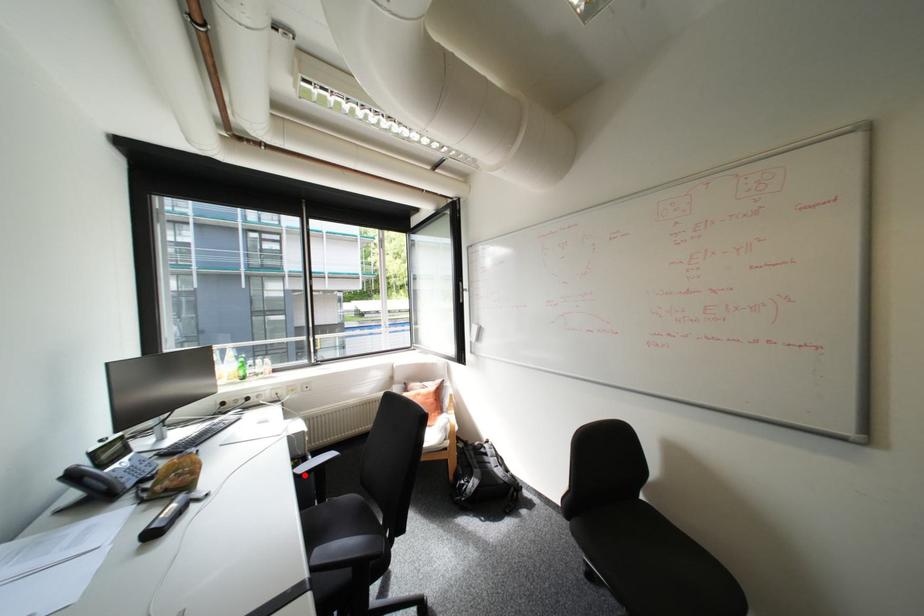
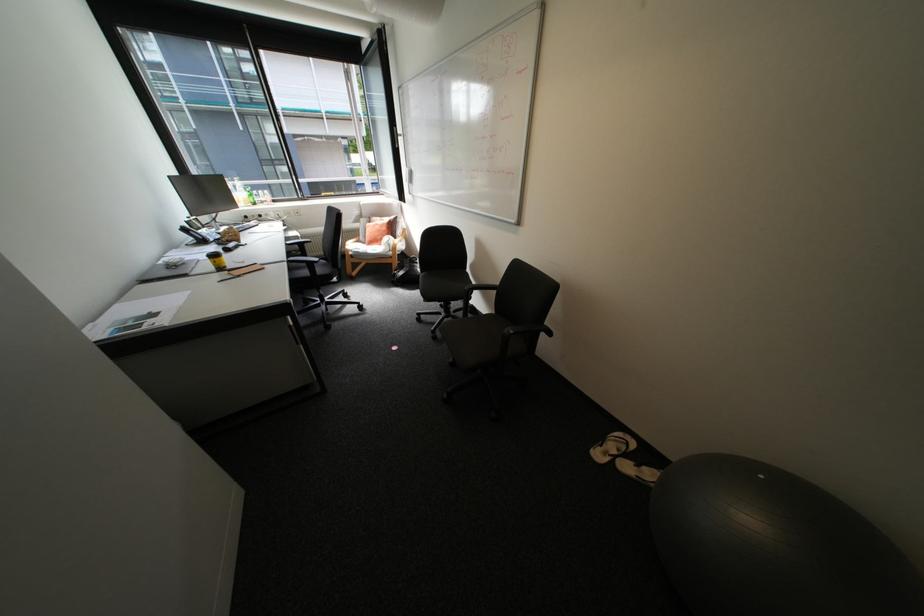
The point at the highlighted location is marked in the first image. Where is the corresponding point in the second image?

(296, 244)